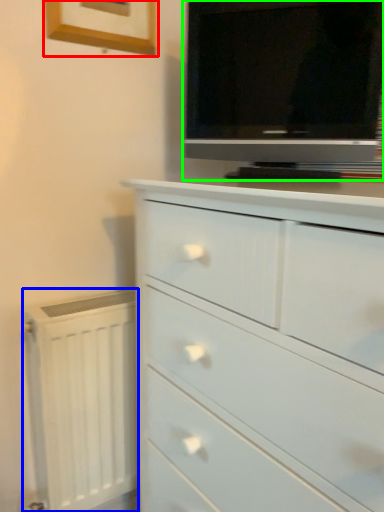
Question: Considering the real-world distances, which object is farthest from picture frame (highlighted by a red box)? radiator (highlighted by a blue box) or television (highlighted by a green box)?

Choices:
 (A) radiator
 (B) television

Answer: (A)